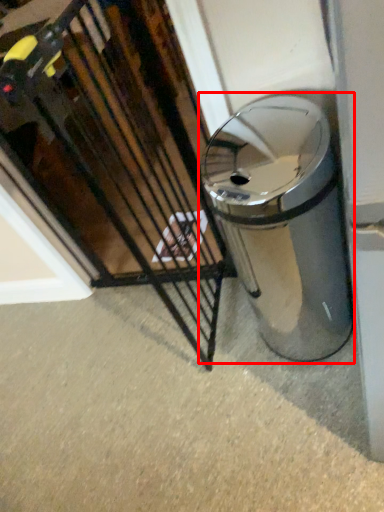
Question: In this image, where is waste container (annotated by the red box) located relative to cage?

Choices:
 (A) left
 (B) right

Answer: (B)